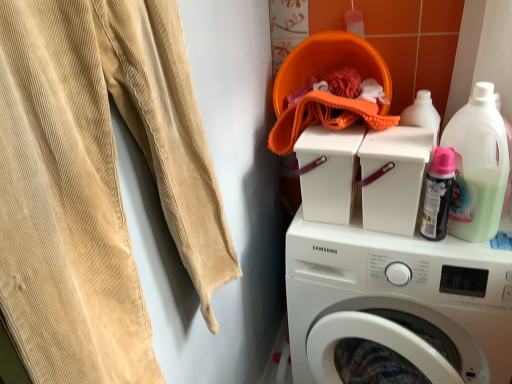
Question: Is beige corduroy sweat pants at left bigger or smaller than matte black spray can at upper right?

Choices:
 (A) big
 (B) small

Answer: (A)

Question: From a real-world perspective, is beige corduroy sweat pants at left above or below matte black spray can at upper right?

Choices:
 (A) above
 (B) below

Answer: (A)

Question: Which of these objects is positioned farthest from the translucent plastic detergent at upper right?

Choices:
 (A) white plastic container at center
 (B) white plastic washing machine at upper right, acting as the 2th washing machine starting from the top
 (C) matte black spray can at upper right
 (D) beige corduroy sweat pants at left
 (E) white plastic washing machine at center, the 1th washing machine positioned from the top

Answer: (D)

Question: Which object is the closest to the white plastic washing machine at center, acting as the 2th washing machine starting from the bottom?

Choices:
 (A) translucent plastic detergent at upper right
 (B) matte black spray can at upper right
 (C) white plastic container at center
 (D) white plastic washing machine at upper right, acting as the 2th washing machine starting from the top
 (E) beige corduroy sweat pants at left

Answer: (C)